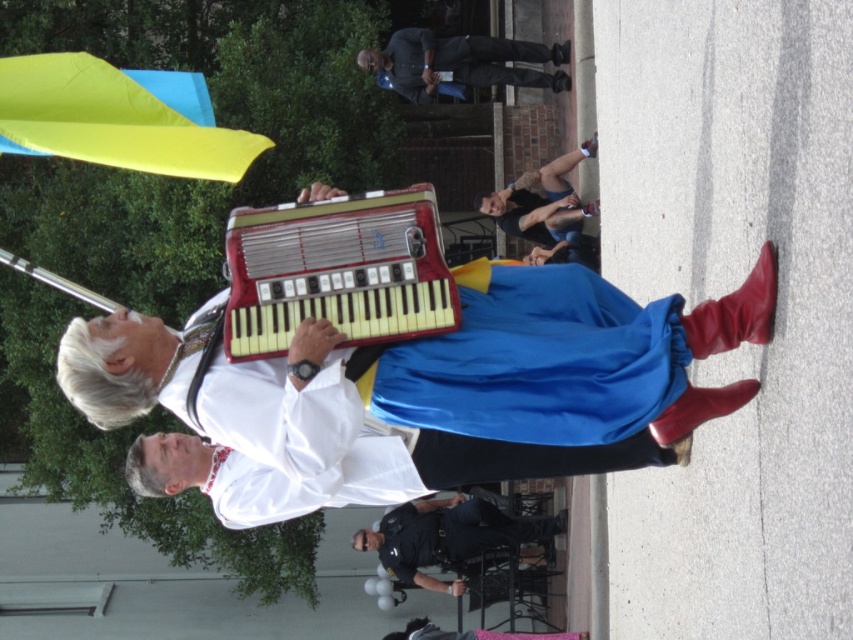
Question: Is matte white accordion at center below dark blue shirt at center?

Choices:
 (A) no
 (B) yes

Answer: (B)

Question: Is dark blue uniform at center to the right of blue denim jeans at upper center from the viewer's perspective?

Choices:
 (A) no
 (B) yes

Answer: (A)

Question: Which object is the farthest from the blue denim jeans at upper center?

Choices:
 (A) metallic red accordion at center
 (B) dark blue shirt at center
 (C) dark blue uniform at center
 (D) matte white accordion at center

Answer: (A)

Question: Is dark blue uniform at center smaller than blue denim jeans at upper center?

Choices:
 (A) no
 (B) yes

Answer: (A)

Question: Which of these objects is positioned farthest from the matte white accordion at center?

Choices:
 (A) dark blue uniform at center
 (B) blue denim jeans at upper center
 (C) metallic red accordion at center

Answer: (A)

Question: Which object is closer to the camera taking this photo?

Choices:
 (A) matte white accordion at center
 (B) dark blue shirt at center
 (C) dark blue uniform at center
 (D) metallic red accordion at center

Answer: (A)